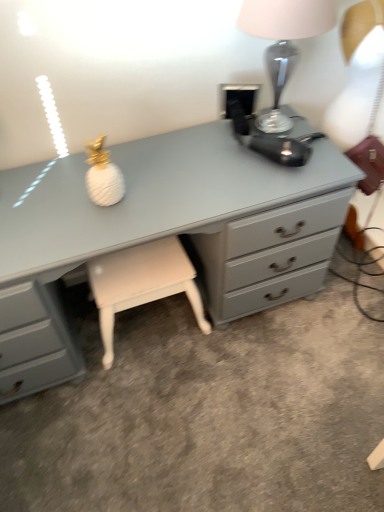
Identify the location of space that is in front of white leather stool at center. (143, 404).